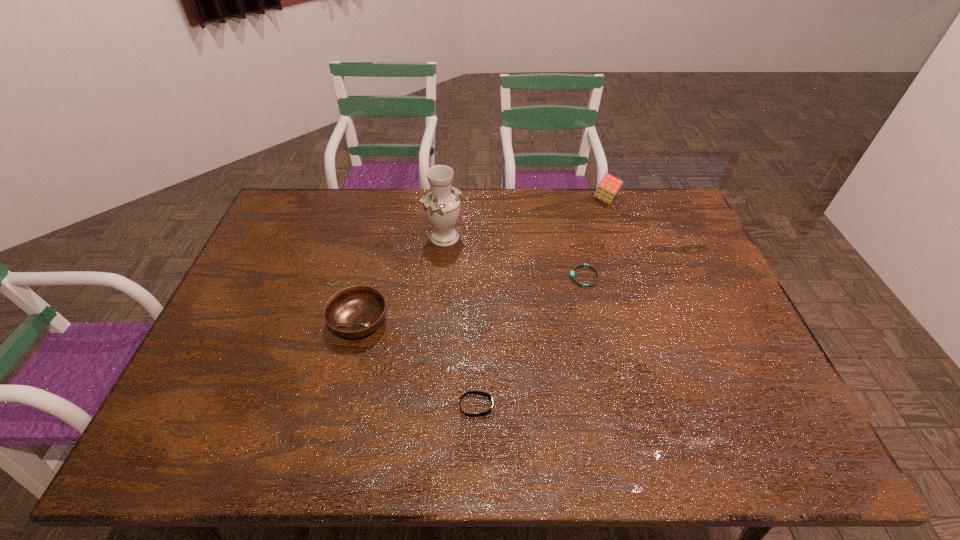
I want to click on blank region between the shorter wristband and the leftmost object, so click(471, 299).

This screenshot has height=540, width=960. Find the location of `free space between the fourth object from left to right and the leftmost object`. free space between the fourth object from left to right and the leftmost object is located at coordinates (471, 299).

Find the location of a particular element. The width and height of the screenshot is (960, 540). vacant space that's between the third shortest object and the nearer wristband is located at coordinates (418, 363).

Where is `object that is the second closest to the right wristband`? Image resolution: width=960 pixels, height=540 pixels. object that is the second closest to the right wristband is located at coordinates (442, 205).

You are a GUI agent. You are given a task and a screenshot of the screen. Output one action in this format:
    pyautogui.click(x=<x>, y=<y>)
    Task: Click on the object that stands as the fourth closest to the leftmost object
    The image size is (960, 540).
    Given the screenshot: What is the action you would take?
    pyautogui.click(x=609, y=186)